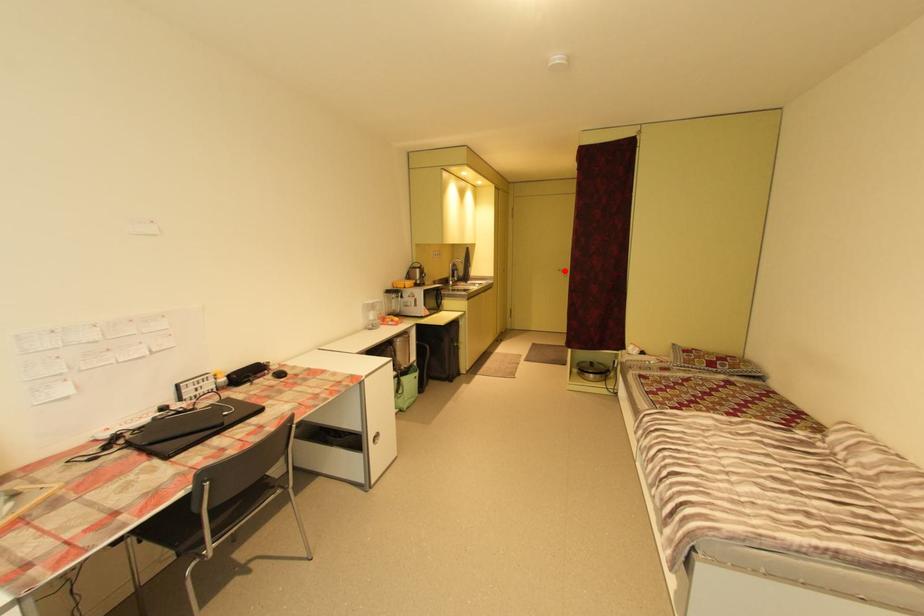
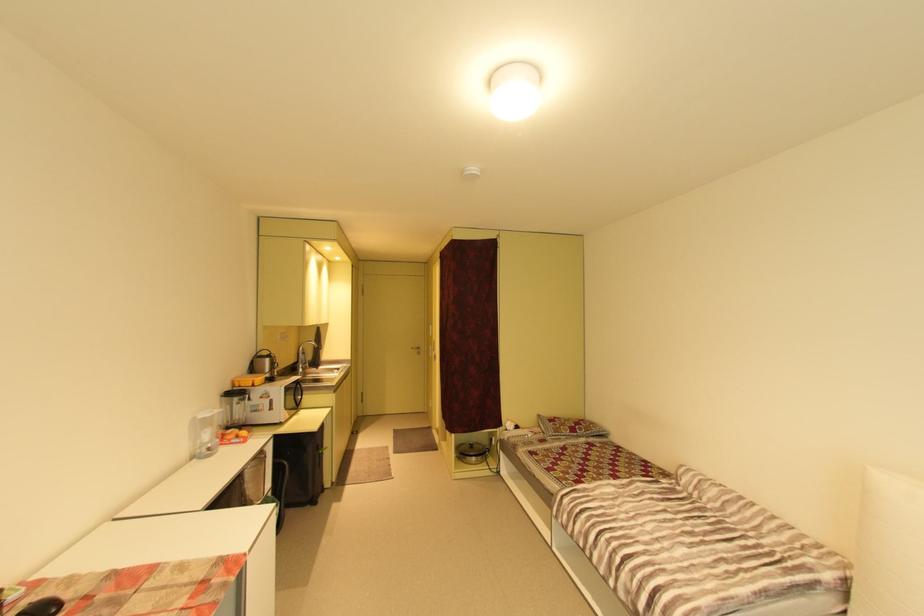
Where in the second image is the point corresponding to the highlighted location from the first image?

(419, 349)